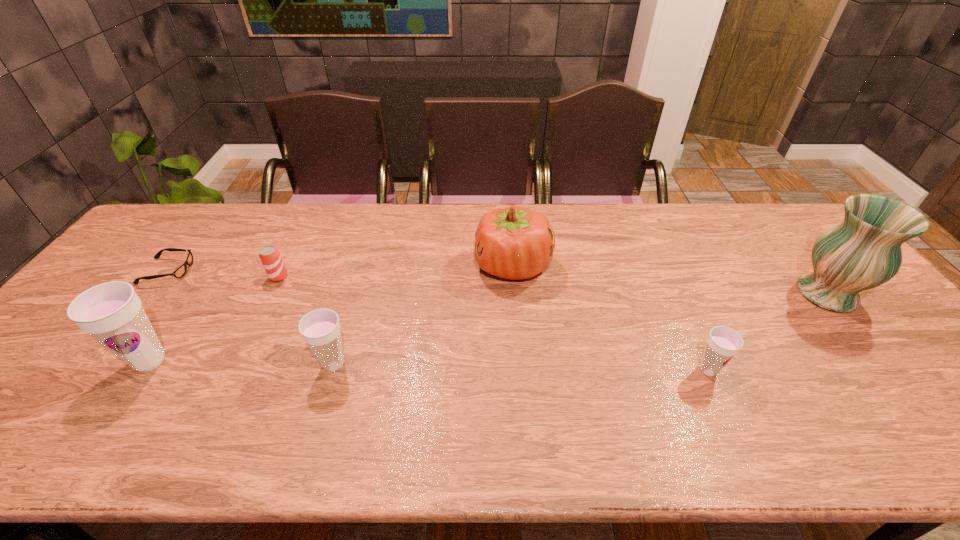
The width and height of the screenshot is (960, 540). I want to click on the sixth tallest object, so click(270, 257).

The height and width of the screenshot is (540, 960). Find the location of `vacant space located on the right of the tallest cup`. vacant space located on the right of the tallest cup is located at coordinates (315, 361).

Where is `vacant area situated 0.400m on the left of the fourth shortest object`? vacant area situated 0.400m on the left of the fourth shortest object is located at coordinates coord(150,364).

Locate an element on the screen. Image resolution: width=960 pixels, height=540 pixels. free point located on the left of the fifth tallest object is located at coordinates (643, 370).

Image resolution: width=960 pixels, height=540 pixels. What are the coordinates of `vacant area situated on the left of the vase` in the screenshot? It's located at (752, 294).

At what (x,y) coordinates should I click in order to perform the action: click on vacant point located on the side of the fifth object from left to right with the cute face. Please return your answer as a coordinate pair (x, y). This screenshot has width=960, height=540. Looking at the image, I should click on (458, 265).

Locate an element on the screen. The width and height of the screenshot is (960, 540). vacant space situated 0.050m on the side of the fifth object from left to right with the cute face is located at coordinates (458, 265).

Where is `vacant space located 0.280m on the side of the fifth object from left to right with the cute face`? This screenshot has width=960, height=540. vacant space located 0.280m on the side of the fifth object from left to right with the cute face is located at coordinates (381, 265).

The width and height of the screenshot is (960, 540). Find the location of `free space located on the front-facing side of the spectacles`. free space located on the front-facing side of the spectacles is located at coordinates (228, 271).

Identify the location of vacant area located on the left of the beer can. (132, 277).